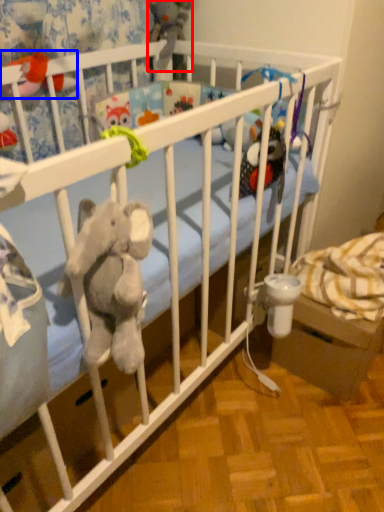
Question: Which of the following is the farthest to the observer, toy (highlighted by a red box) or toy (highlighted by a blue box)?

Choices:
 (A) toy
 (B) toy

Answer: (A)